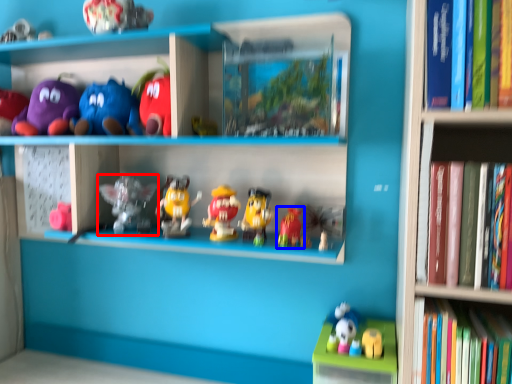
Question: Among these objects, which one is farthest to the camera, toy (highlighted by a red box) or toy (highlighted by a blue box)?

Choices:
 (A) toy
 (B) toy

Answer: (A)